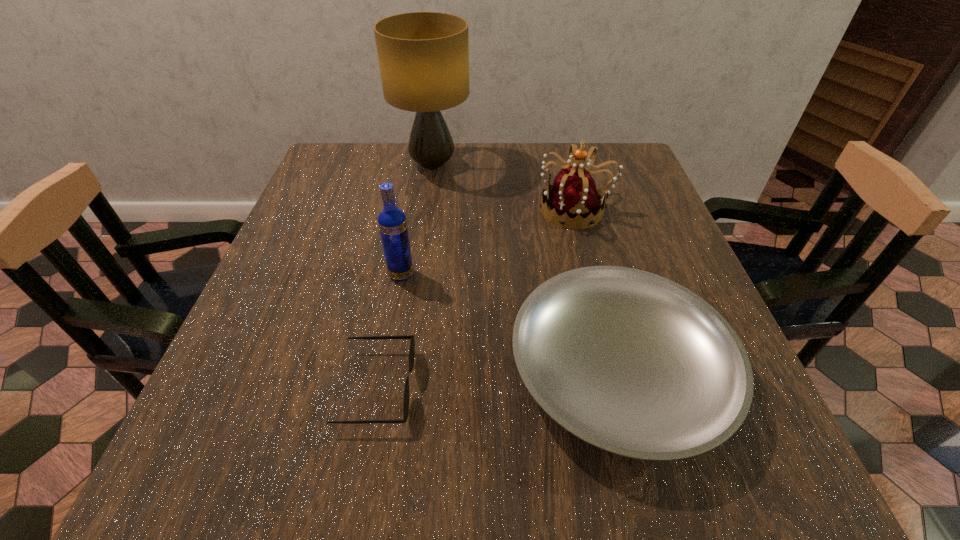
The width and height of the screenshot is (960, 540). What are the coordinates of `free space that is in between the shortest object and the bedpan` in the screenshot? It's located at click(497, 379).

The width and height of the screenshot is (960, 540). In order to click on free space between the third farthest object and the sunglasses in this screenshot , I will do `click(389, 331)`.

Find the location of a particular element. The height and width of the screenshot is (540, 960). object identified as the fourth closest to the third farthest object is located at coordinates (423, 57).

Select which object appears as the closest to the vodka. Please provide its 2D coordinates. Your answer should be formatted as a tuple, i.e. [(x, y)], where the tuple contains the x and y coordinates of a point satisfying the conditions above.

[(412, 343)]

Find the location of `free point that satisfies the following two spatial constraints: 1. on the front-facing side of the bedpan; 2. on the right side of the fourth nearest object`. free point that satisfies the following two spatial constraints: 1. on the front-facing side of the bedpan; 2. on the right side of the fourth nearest object is located at coordinates (615, 371).